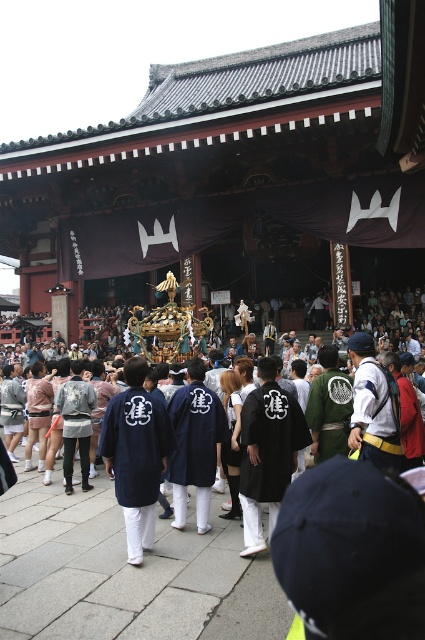
Does navy blue fabric robe at center lie in front of black matte robe at center?

Yes, navy blue fabric robe at center is closer to the viewer.

Does navy blue fabric robe at center have a lesser height compared to black matte robe at center?

Yes, navy blue fabric robe at center is shorter than black matte robe at center.

Does point (150, 508) come closer to viewer compared to point (255, 413)?

Yes, point (150, 508) is closer to viewer.

This screenshot has width=425, height=640. I want to click on navy blue fabric robe at center, so click(x=136, y=460).